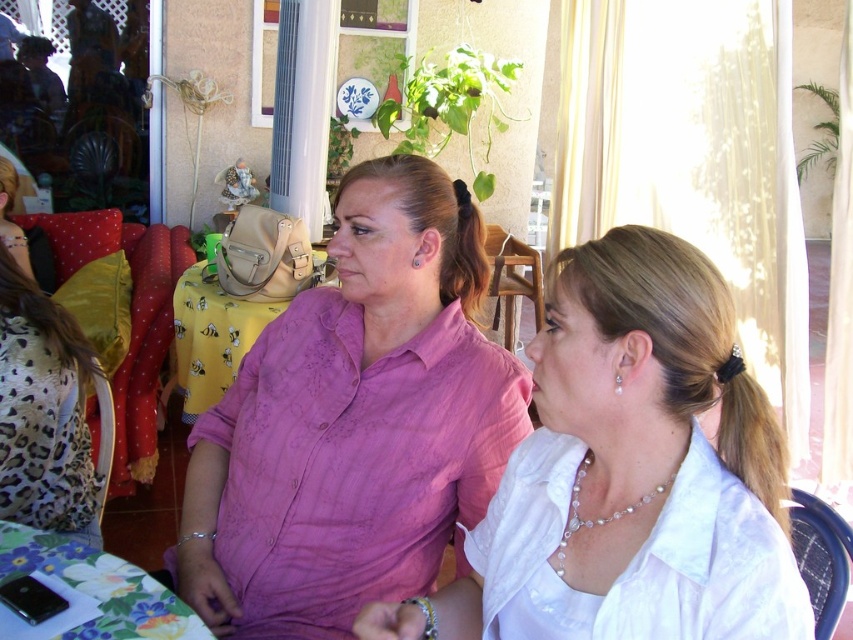
Question: Can you confirm if white satin shirt at center is bigger than leopard print dress at left?

Choices:
 (A) yes
 (B) no

Answer: (B)

Question: Does leopard print dress at left appear on the left side of yellow fabric table at center?

Choices:
 (A) yes
 (B) no

Answer: (A)

Question: Can you confirm if pink satin blouse at center is positioned to the right of yellow fabric table at center?

Choices:
 (A) yes
 (B) no

Answer: (A)

Question: Which object is positioned closest to the pearl necklace at center?

Choices:
 (A) pink satin blouse at center
 (B) leopard print dress at left
 (C) white satin blouse at center
 (D) yellow fabric table at center

Answer: (C)

Question: Among these objects, which one is farthest from the camera?

Choices:
 (A) white satin blouse at center
 (B) pearl necklace at center
 (C) white satin shirt at center
 (D) floral-patterned fabric at lower left

Answer: (D)

Question: Which of the following is the closest to the observer?

Choices:
 (A) (795, 611)
 (B) (386, 200)

Answer: (A)